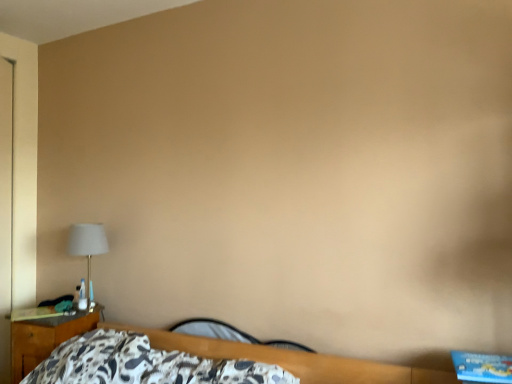
Question: Considering the positions of matte white lampshade at left and black leather guitar at lower center in the image, is matte white lampshade at left bigger or smaller than black leather guitar at lower center?

Choices:
 (A) big
 (B) small

Answer: (A)

Question: From the image's perspective, is matte white lampshade at left above or below black leather guitar at lower center?

Choices:
 (A) above
 (B) below

Answer: (A)

Question: Estimate the real-world distances between objects in this image. Which object is farther from the black leather guitar at lower center?

Choices:
 (A) wooden nightstand at left
 (B) matte white lampshade at left

Answer: (B)

Question: Considering the real-world distances, which object is farthest from the black leather guitar at lower center?

Choices:
 (A) matte white lampshade at left
 (B) wooden nightstand at left

Answer: (A)